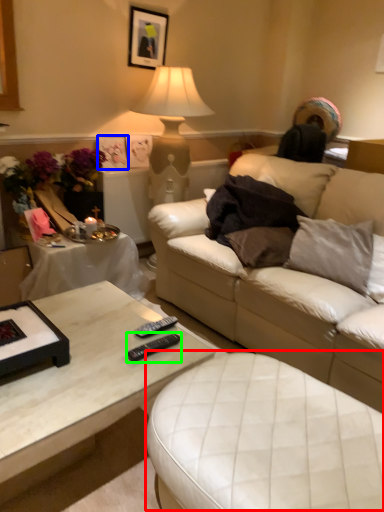
Question: Which object is positioned farthest from swivel chair (highlighted by a red box)? Select from picture frame (highlighted by a blue box) and remote (highlighted by a green box).

Choices:
 (A) picture frame
 (B) remote

Answer: (A)